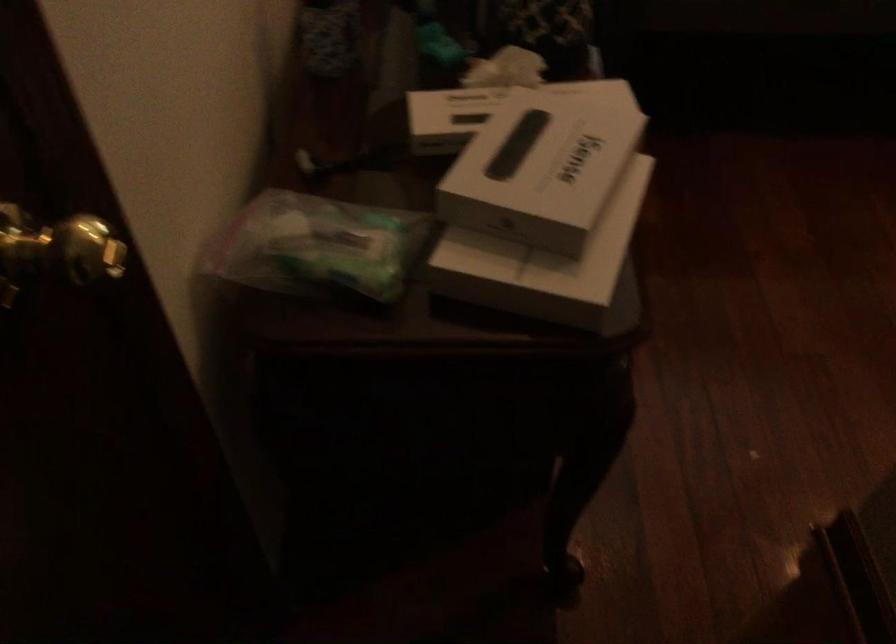
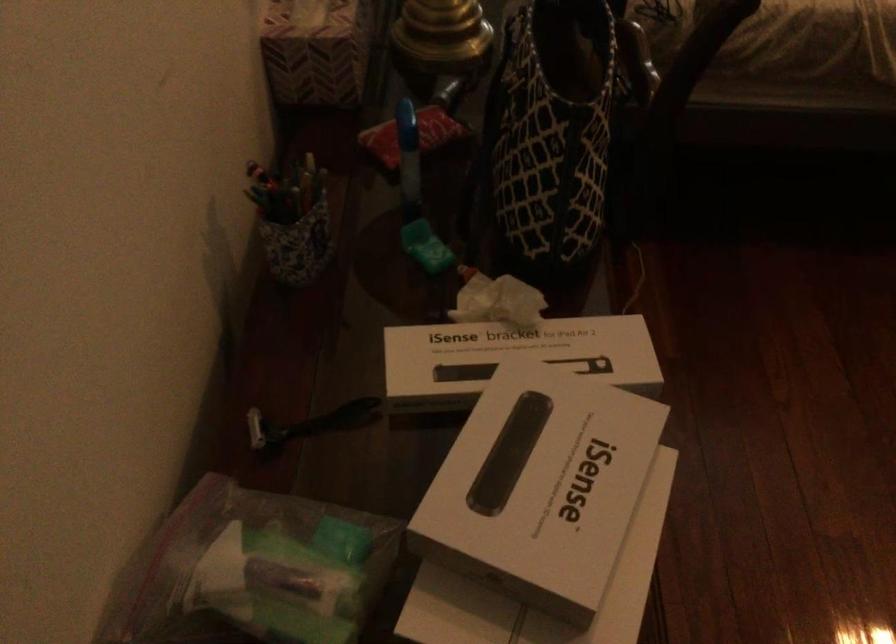
Find the pixel in the second image that matches (x=520, y=84) in the first image.

(515, 353)